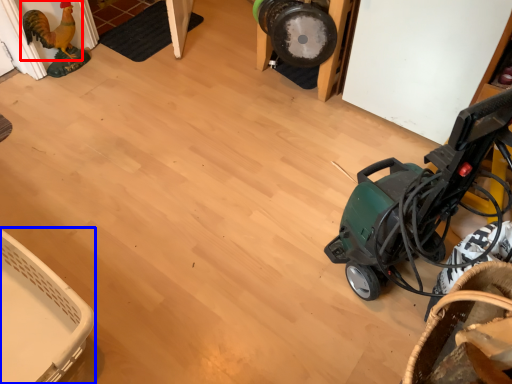
Question: Which object appears farthest to the camera in this image, chicken (highlighted by a red box) or basket (highlighted by a blue box)?

Choices:
 (A) chicken
 (B) basket

Answer: (A)